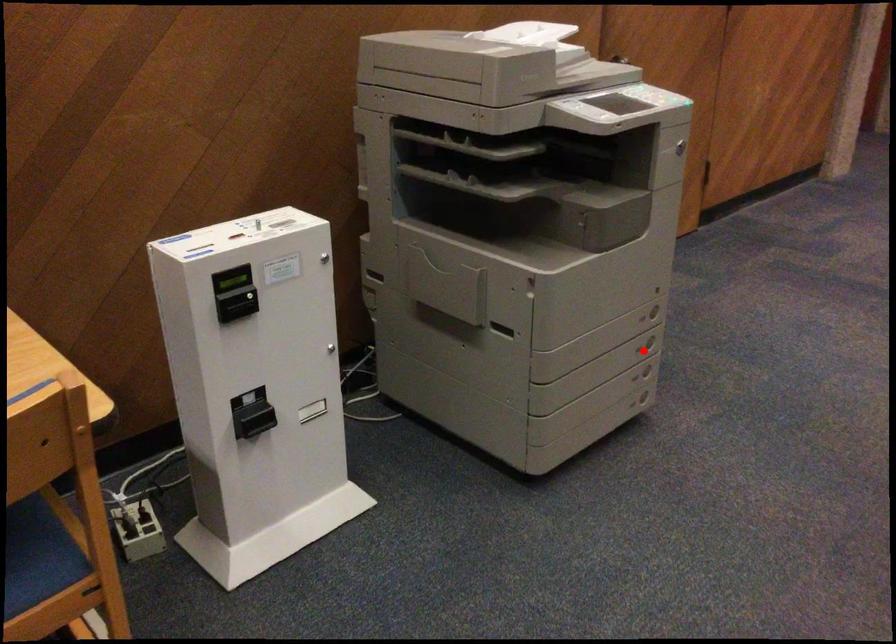
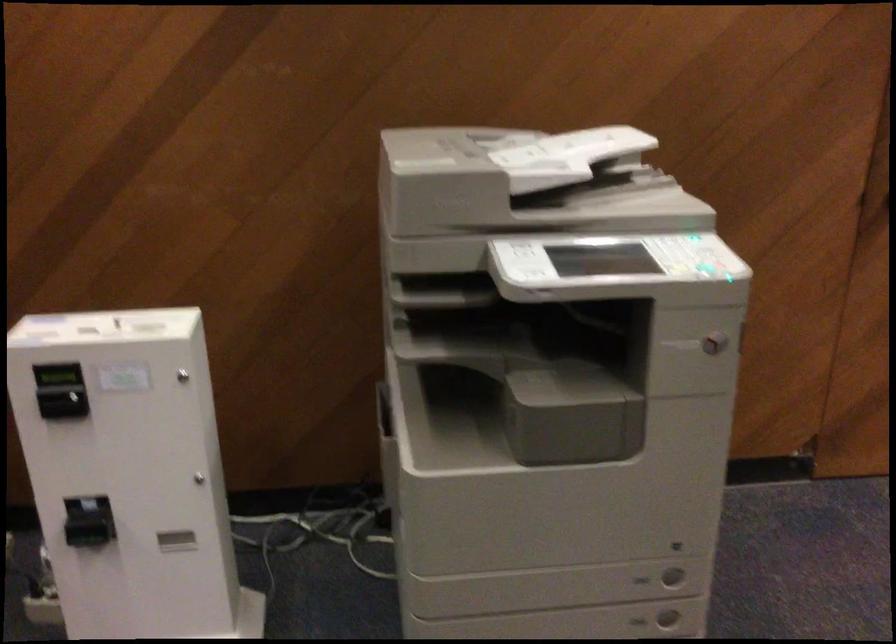
Question: I am providing you with two images of the same scene from different viewpoints. A red point is shown in image1. For the corresponding object point in image2, is it positioned nearer or farther from the camera?

Choices:
 (A) Nearer
 (B) Farther

Answer: (A)